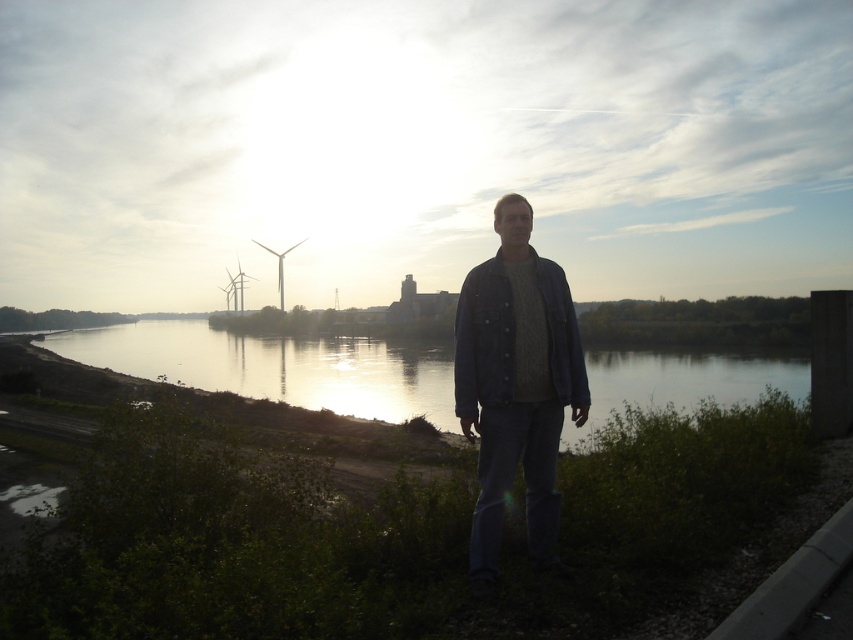
Question: Considering the relative positions of denim jacket at center and metallic wind turbine at center in the image provided, where is denim jacket at center located with respect to metallic wind turbine at center?

Choices:
 (A) right
 (B) left

Answer: (A)

Question: Which object is closer to the camera taking this photo?

Choices:
 (A) denim jacket at center
 (B) silvery reflective water at center
 (C) white plastic windmill at left
 (D) metallic wind turbine at center

Answer: (A)

Question: Can you confirm if white plastic windmill at left is positioned above metallic wind turbine at center?

Choices:
 (A) yes
 (B) no

Answer: (B)

Question: Which point is closer to the camera?

Choices:
 (A) white plastic windmill at left
 (B) denim jacket at center
 (C) silvery reflective water at center
 (D) metallic wind turbine at center

Answer: (B)

Question: Does silvery reflective water at center come behind metallic wind turbine at center?

Choices:
 (A) no
 (B) yes

Answer: (A)

Question: Based on their relative distances, which object is farther from the denim jacket at center?

Choices:
 (A) silvery reflective water at center
 (B) white plastic windmill at left

Answer: (B)